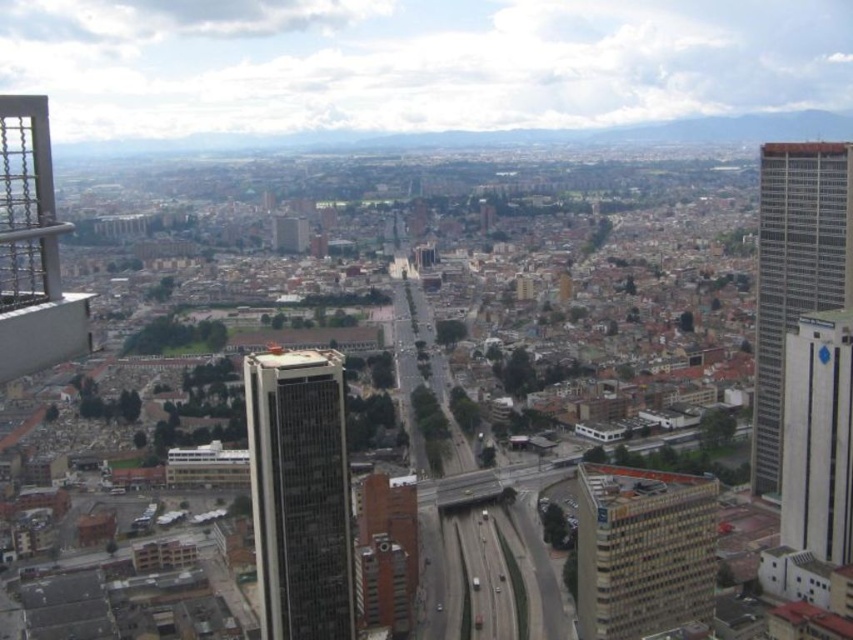
Between glassy gray skyscraper at center and white glossy building at right, which one has more height?

With more height is glassy gray skyscraper at center.

Between glassy gray skyscraper at center and white glossy building at right, which one is positioned higher?

white glossy building at right is higher up.

Is point (331, 579) behind point (843, 380)?

That is False.

I want to click on glassy gray skyscraper at center, so click(299, 493).

In the scene shown: Does gray glass skyscraper at right have a lesser width compared to white glossy building at right?

No, gray glass skyscraper at right is not thinner than white glossy building at right.

Is the position of gray glass skyscraper at right less distant than that of white glossy building at right?

That is False.

This screenshot has width=853, height=640. Describe the element at coordinates (795, 272) in the screenshot. I see `gray glass skyscraper at right` at that location.

The image size is (853, 640). I want to click on gray glass skyscraper at right, so click(795, 272).

Which is more to the left, beige textured building at center or white glossy building at right?

From the viewer's perspective, beige textured building at center appears more on the left side.

The width and height of the screenshot is (853, 640). What do you see at coordinates (643, 550) in the screenshot?
I see `beige textured building at center` at bounding box center [643, 550].

Does point (614, 570) come closer to viewer compared to point (807, 460)?

That is True.

Locate an element on the screen. The width and height of the screenshot is (853, 640). beige textured building at center is located at coordinates (643, 550).